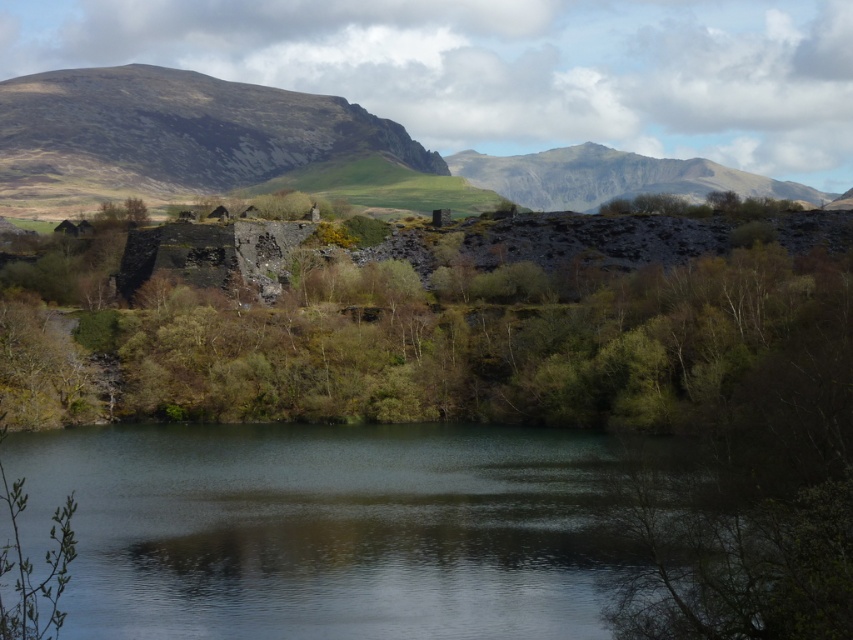
Is point (184, 435) behind point (801, 182)?

That is False.

Locate an element on the screen. The image size is (853, 640). greenish reflective water at center is located at coordinates (328, 529).

Is point (187, 512) behind point (564, 189)?

No.

Where is `greenish reflective water at center`? greenish reflective water at center is located at coordinates (328, 529).

Which is more to the left, greenish reflective water at center or green leafy tree at center?

greenish reflective water at center

Looking at this image, does greenish reflective water at center have a lesser width compared to green leafy tree at center?

Yes.

Which is behind, point (486, 560) or point (184, 374)?

The point (184, 374) is more distant.

Locate an element on the screen. The width and height of the screenshot is (853, 640). greenish reflective water at center is located at coordinates (328, 529).

Who is shorter, greenish reflective water at center or rugged stone mountain at upper left?

With less height is greenish reflective water at center.

Does greenish reflective water at center appear on the right side of rugged stone mountain at upper left?

Indeed, greenish reflective water at center is positioned on the right side of rugged stone mountain at upper left.

Is point (149, 513) positioned behind point (115, 109)?

No, (149, 513) is closer to viewer.

Where is `greenish reflective water at center`? The width and height of the screenshot is (853, 640). greenish reflective water at center is located at coordinates (328, 529).